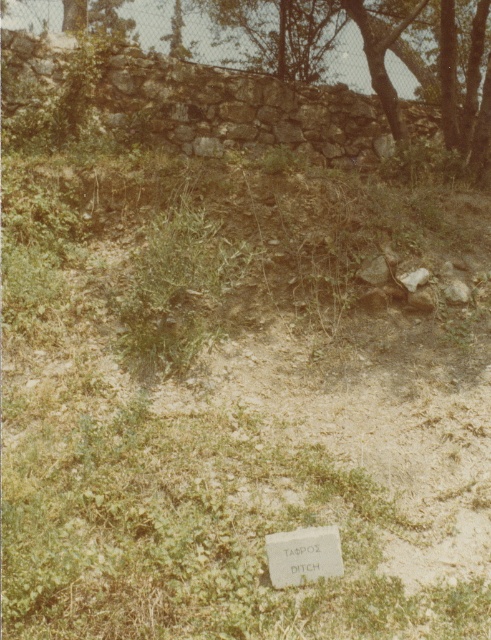
Question: Which of the following is the closest to the observer?

Choices:
 (A) dark green leafy tree at upper center
 (B) white stone plaque at center

Answer: (B)

Question: Is dark green leafy tree at upper center positioned in front of white stone plaque at center?

Choices:
 (A) no
 (B) yes

Answer: (A)

Question: Is dark green leafy tree at upper center positioned in front of white stone plaque at center?

Choices:
 (A) no
 (B) yes

Answer: (A)

Question: Is dark green leafy tree at upper center closer to camera compared to white stone plaque at center?

Choices:
 (A) no
 (B) yes

Answer: (A)

Question: Which point appears closest to the camera in this image?

Choices:
 (A) (288, 582)
 (B) (367, 108)

Answer: (A)